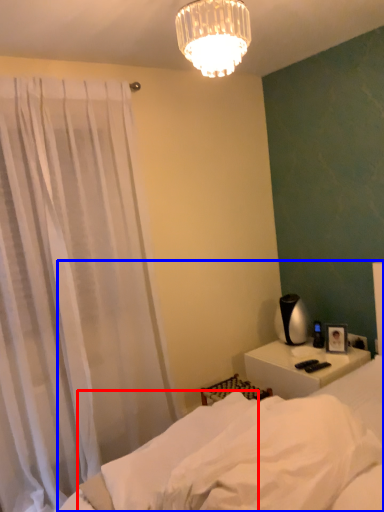
Question: Which object is closer to the camera taking this photo, sheet (highlighted by a red box) or bed (highlighted by a blue box)?

Choices:
 (A) sheet
 (B) bed

Answer: (B)